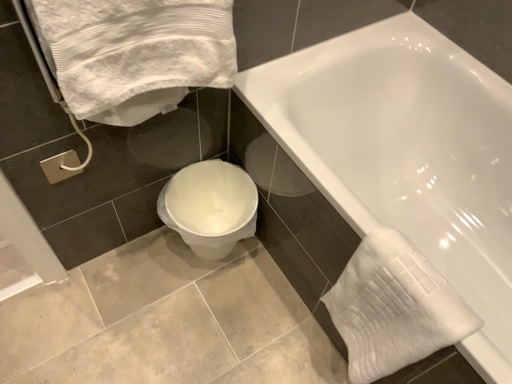
Question: Considering the positions of white glossy bathtub at center and white textured towel at upper left, positioned as the 1th bath towel in left-to-right order, in the image, is white glossy bathtub at center taller or shorter than white textured towel at upper left, positioned as the 1th bath towel in left-to-right order,?

Choices:
 (A) tall
 (B) short

Answer: (A)

Question: From the image's perspective, is white glossy bathtub at center located above or below white textured towel at upper left, positioned as the 1th bath towel in left-to-right order?

Choices:
 (A) above
 (B) below

Answer: (B)

Question: Which of these objects is positioned farthest from the white glossy bathtub at center?

Choices:
 (A) white textured towel at upper left, the first bath towel when ordered from top to bottom
 (B) white textured towel at lower right, positioned as the 1th bath towel in bottom-to-top order
 (C) silver metallic towel bar at lower left
 (D) white plastic toilet at lower center

Answer: (C)

Question: Estimate the real-world distances between objects in this image. Which object is closer to the silver metallic towel bar at lower left?

Choices:
 (A) white textured towel at lower right, which is the 2th bath towel in top-to-bottom order
 (B) white plastic toilet at lower center
 (C) white glossy bathtub at center
 (D) white textured towel at upper left, positioned as the 1th bath towel in left-to-right order

Answer: (D)